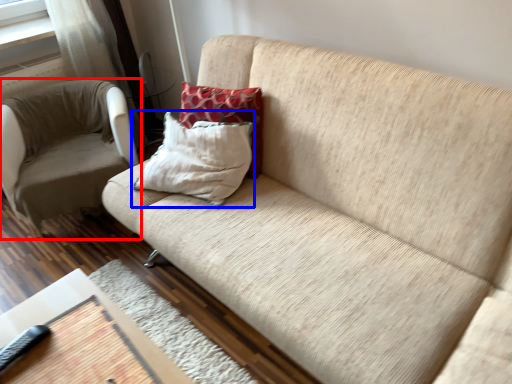
Question: Which object is further to the camera taking this photo, chair (highlighted by a red box) or pillow (highlighted by a blue box)?

Choices:
 (A) chair
 (B) pillow

Answer: (A)